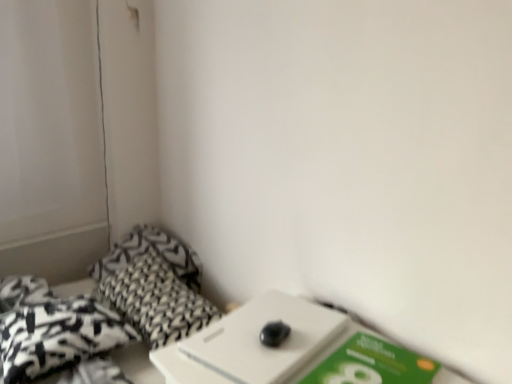
Question: Considering the positions of point (157, 261) and point (203, 322), is point (157, 261) closer or farther from the camera than point (203, 322)?

Choices:
 (A) closer
 (B) farther

Answer: (B)

Question: From a real-world perspective, relative to black textured pillow at lower left, the 1th pillow from the front, is black printed fabric at lower left vertically above or below?

Choices:
 (A) below
 (B) above

Answer: (A)

Question: Which is farther from the white plastic table at lower left?

Choices:
 (A) black and white patterned throw pillow at lower left
 (B) black printed fabric at lower left
 (C) green matte paperback book at lower right
 (D) black textured pillow at lower left, the 2th pillow in the back-to-front sequence
 (E) black textured pillow at lower left, which appears as the 2th pillow when viewed from the front

Answer: (E)

Question: Which is nearer to the black and white patterned throw pillow at lower left?

Choices:
 (A) white plastic table at lower left
 (B) black textured pillow at lower left, the 1th pillow from the front
 (C) green matte paperback book at lower right
 (D) black textured pillow at lower left, which is the first pillow in back-to-front order
 (E) black printed fabric at lower left

Answer: (E)